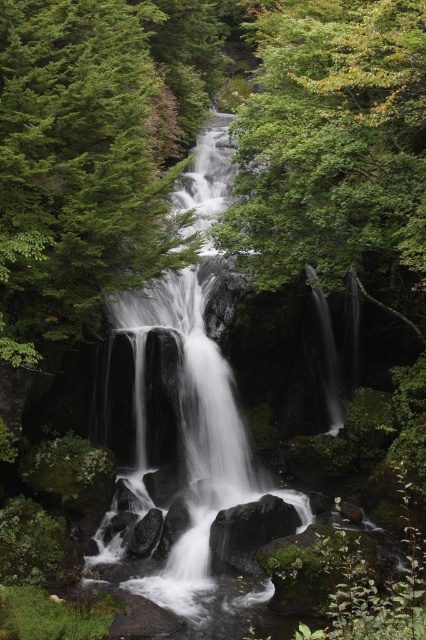
Which is in front, point (25, 29) or point (382, 104)?

Point (382, 104) is in front.

Locate an element on the screen. This screenshot has width=426, height=640. green matte tree at center is located at coordinates pyautogui.click(x=80, y=164).

Identify the location of green matte tree at center. (80, 164).